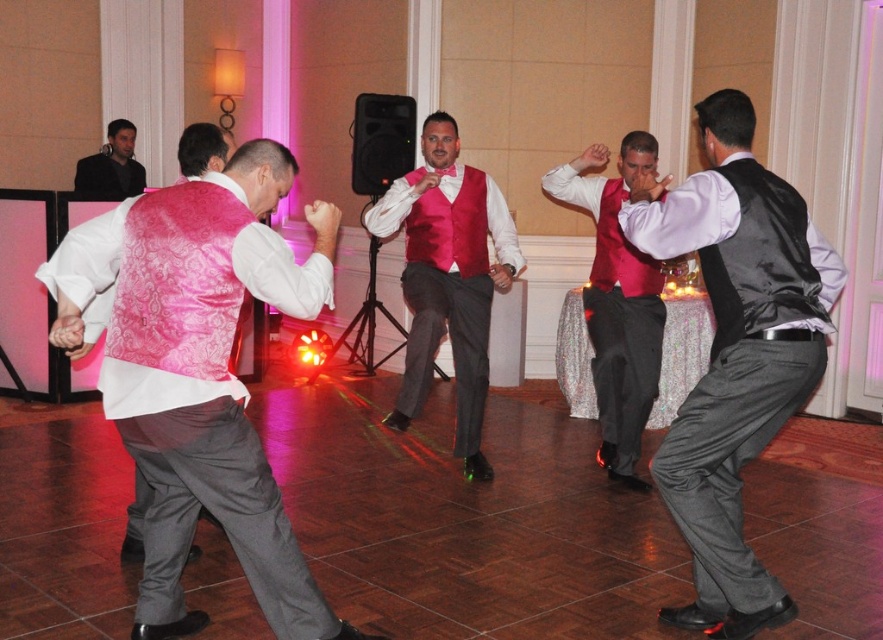
Question: Is shiny red vest at center above pink paisley vest at left?

Choices:
 (A) yes
 (B) no

Answer: (B)

Question: Which of the following is the closest to the observer?

Choices:
 (A) matte red vest at center
 (B) shiny red vest at center

Answer: (A)

Question: Among these objects, which one is farthest from the camera?

Choices:
 (A) satin black vest at center
 (B) matte red vest at center
 (C) pink paisley vest at left

Answer: (B)

Question: Which is nearer to the black fabric jacket at upper left?

Choices:
 (A) satin black vest at center
 (B) matte red vest at center
 (C) shiny red vest at center

Answer: (C)

Question: Is pink satin vest at left positioned in front of black fabric jacket at upper left?

Choices:
 (A) yes
 (B) no

Answer: (A)

Question: Can you confirm if matte red vest at center is positioned above pink paisley vest at left?

Choices:
 (A) yes
 (B) no

Answer: (B)